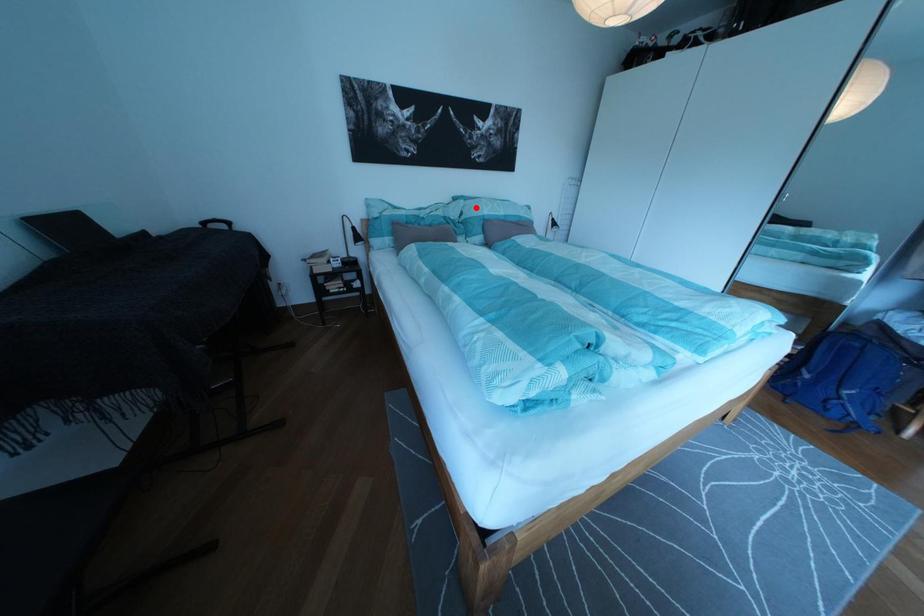
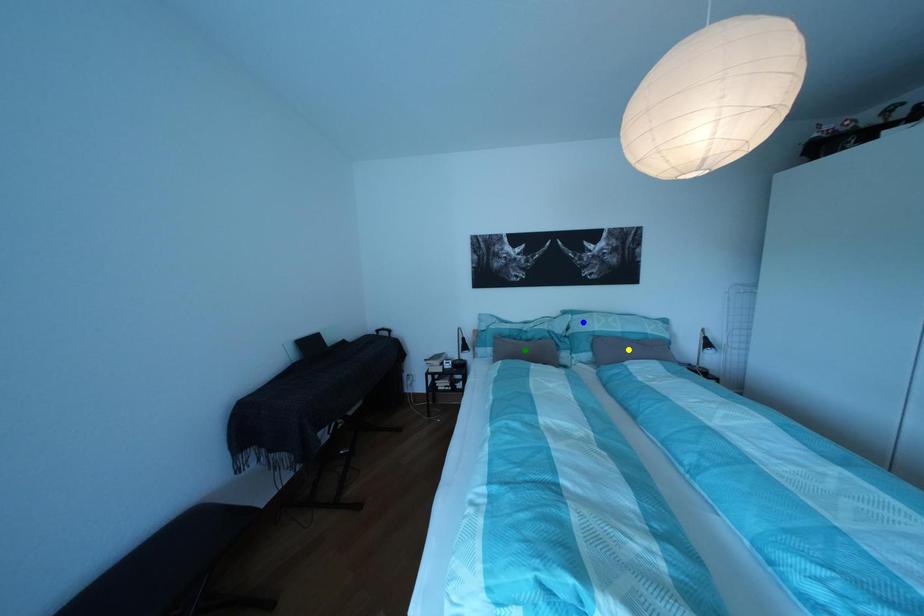
Question: I am providing you with two images of the same scene from different viewpoints. A red point is marked on the first image. You are given multiple points on the second image. Which point in image 2 represents the same 3d spot as the red point in image 1?

Choices:
 (A) green point
 (B) yellow point
 (C) blue point

Answer: (C)